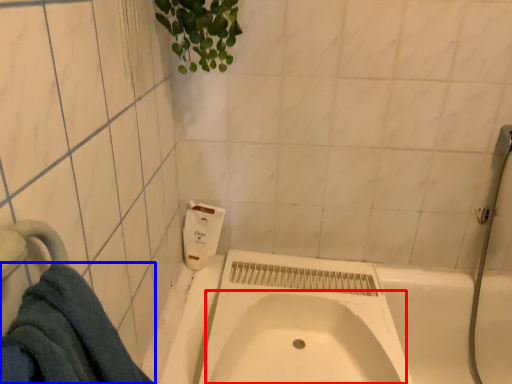
Question: Which object appears farthest to the camera in this image, sink (highlighted by a red box) or towel (highlighted by a blue box)?

Choices:
 (A) sink
 (B) towel

Answer: (A)